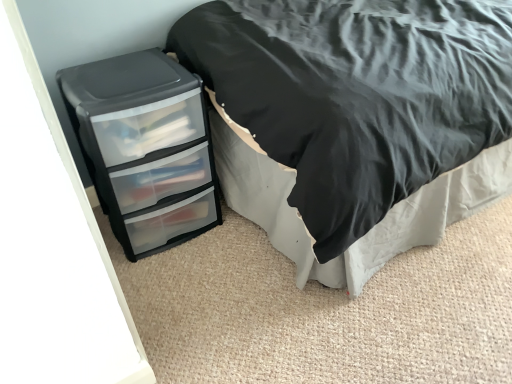
The image size is (512, 384). I want to click on blank space situated above black plastic chest of drawers at lower left (from a real-world perspective), so click(109, 75).